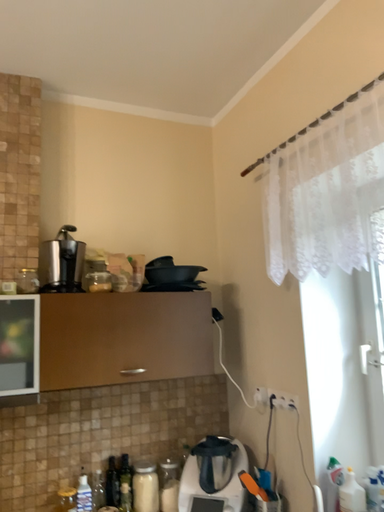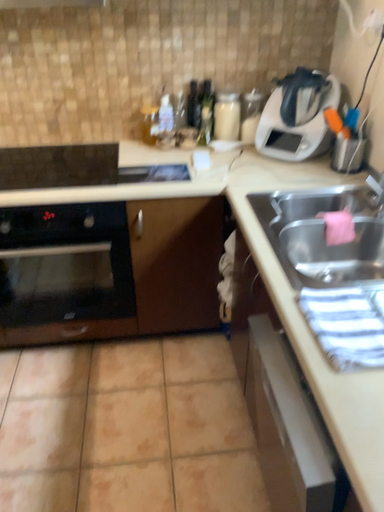
Question: How did the camera likely rotate when shooting the video?

Choices:
 (A) rotated downward
 (B) rotated upward

Answer: (A)